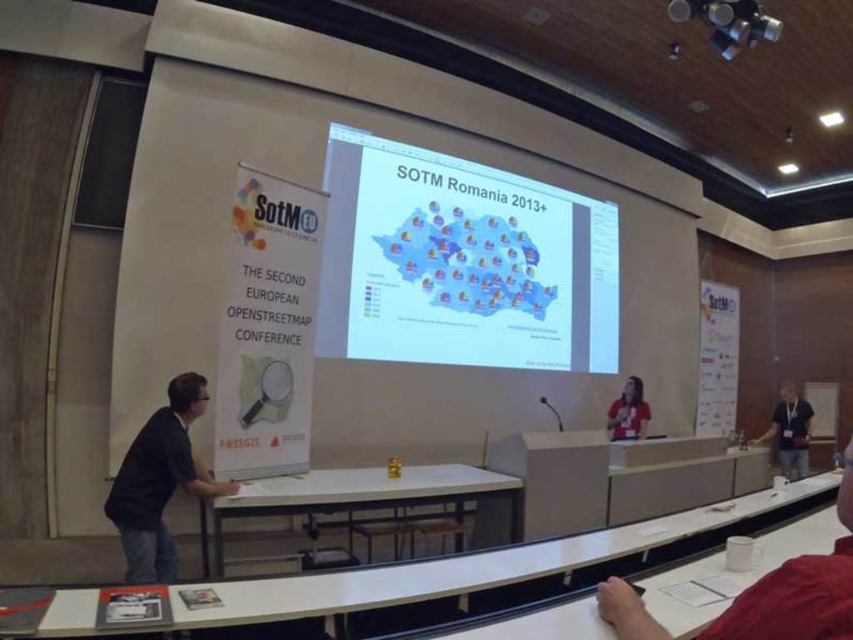
You are standing in the conference hall and want to find the white glossy table at center. According to the coordinate system where the bottom left corner is the origin, can you determine its position relative to the stage?

The white glossy table at center is located at coordinates approximately 0.775 on the x axis and 0.434 on the y axis, which places it in the central area of the conference hall relative to the stage.